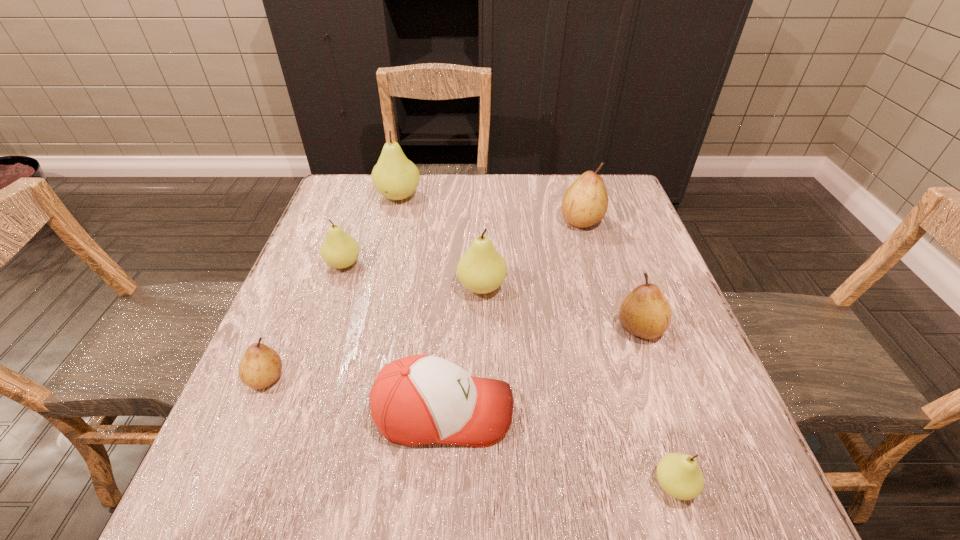
Find the location of a particular element. Image resolution: width=960 pixels, height=540 pixels. vacant area that satisfies the following two spatial constraints: 1. on the front-facing side of the nearest object; 2. on the left side of the baseball cap is located at coordinates (439, 485).

Find the location of `vacant region that satisfies the following two spatial constraints: 1. on the front side of the tallest pear; 2. on the left side of the second farthest brown pear`. vacant region that satisfies the following two spatial constraints: 1. on the front side of the tallest pear; 2. on the left side of the second farthest brown pear is located at coordinates (367, 328).

Locate an element on the screen. vacant area that satisfies the following two spatial constraints: 1. on the front side of the biggest brown pear; 2. on the left side of the second biggest brown pear is located at coordinates [x=612, y=328].

You are a GUI agent. You are given a task and a screenshot of the screen. Output one action in this format:
    pyautogui.click(x=<x>, y=<y>)
    Task: Click on the free space that satisfies the following two spatial constraints: 1. on the front side of the third smallest green pear; 2. on the front-facing side of the baseball cap
    The width and height of the screenshot is (960, 540).
    Given the screenshot: What is the action you would take?
    pyautogui.click(x=483, y=411)